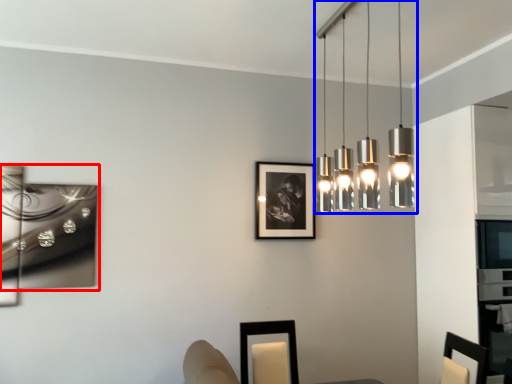
Question: Which of the following is the closest to the observer, picture frame (highlighted by a red box) or lamp (highlighted by a blue box)?

Choices:
 (A) picture frame
 (B) lamp

Answer: (B)